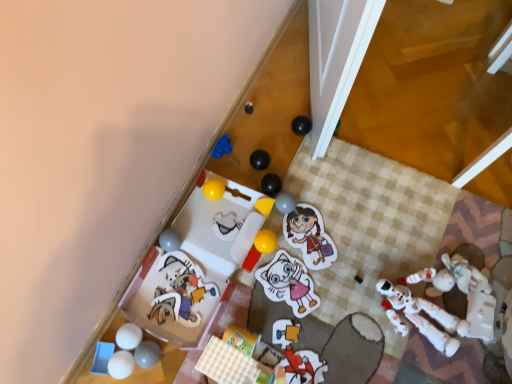
This screenshot has height=384, width=512. Find the location of `free space to the left of matte gray ball at lower left, acting as the fourth toy starting from the left`. free space to the left of matte gray ball at lower left, acting as the fourth toy starting from the left is located at coordinates (100, 348).